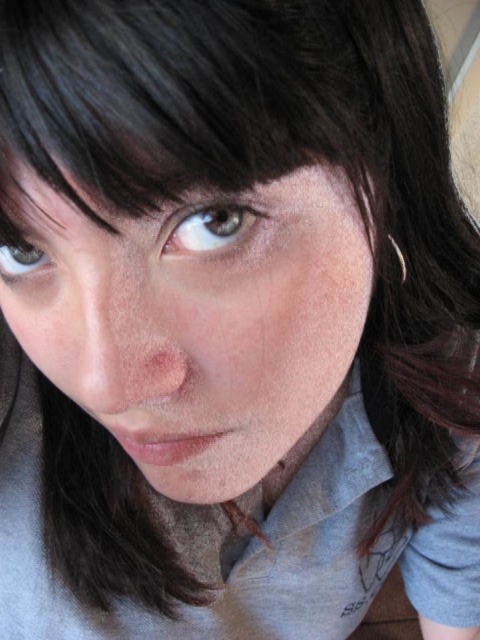
You are a photographer adjusting the focus on your camera. The subject has a smooth skin face at center. If your camera requires the subject to be at least 30 centimeters away for optimal focus, is the current distance sufficient?

The smooth skin face at center and camera are 20.57 centimeters apart, which is less than the required 30 centimeters. Therefore, the current distance is not sufficient for optimal focus.

You are a photographer adjusting the lighting for a portrait. You notice a point at coordinates (197,321) on the subject. Based on the scene description, where is this point located?

The point is on the smooth skin face at center.